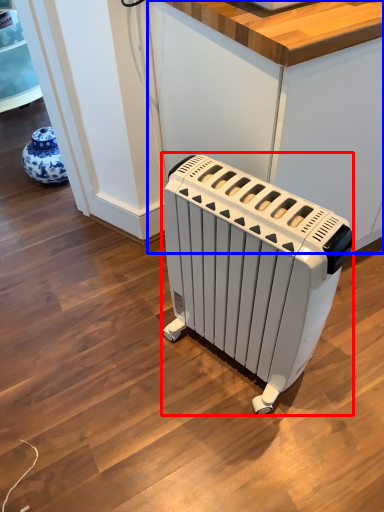
Question: Among these objects, which one is nearest to the camera, home appliance (highlighted by a red box) or counter (highlighted by a blue box)?

Choices:
 (A) home appliance
 (B) counter

Answer: (A)